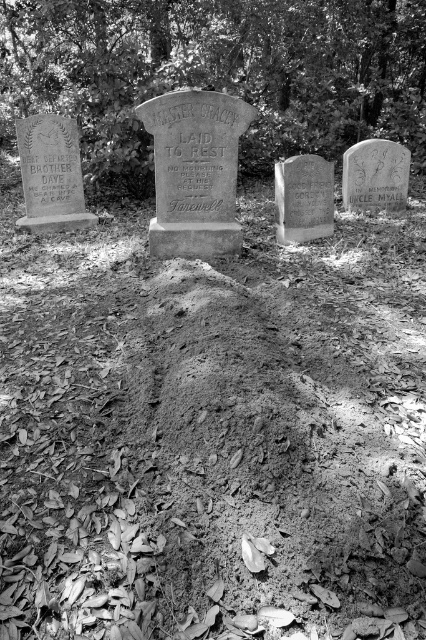
Question: Which object appears closest to the camera in this image?

Choices:
 (A) smooth gray stone at center
 (B) smooth bark tree at upper center
 (C) smooth gray stone gravestone at center

Answer: (A)

Question: Which point appears closest to the camera in this image?

Choices:
 (A) (57, 209)
 (B) (345, 184)
 (C) (282, 177)
 (D) (158, 113)

Answer: (D)

Question: Is matte stone gravestone at left bigger than smooth gray stone at center?

Choices:
 (A) yes
 (B) no

Answer: (A)

Question: Among these objects, which one is nearest to the camera?

Choices:
 (A) matte stone gravestone at left
 (B) smooth gray stone at center

Answer: (B)

Question: Is smooth bark tree at upper center thinner than matte stone gravestone at left?

Choices:
 (A) yes
 (B) no

Answer: (A)

Question: Is smooth bark tree at upper center positioned at the back of matte stone gravestone at left?

Choices:
 (A) yes
 (B) no

Answer: (A)